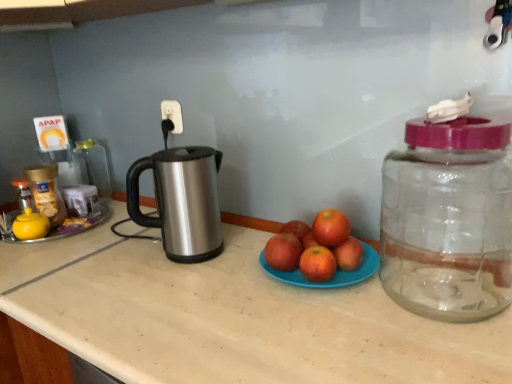
Locate an element on the screen. free space above beige laminate countertop at center (from a real-world perspective) is located at coordinates (187, 290).